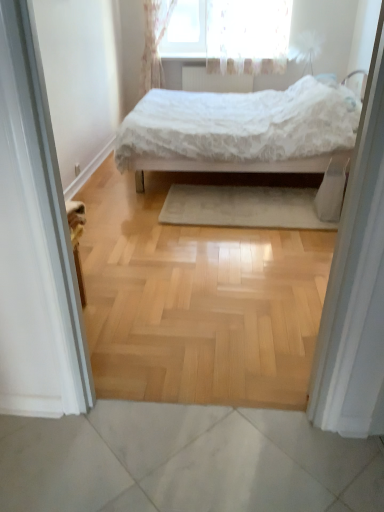
The width and height of the screenshot is (384, 512). I want to click on free region under beige soft rug at center (from a real-world perspective), so click(x=248, y=209).